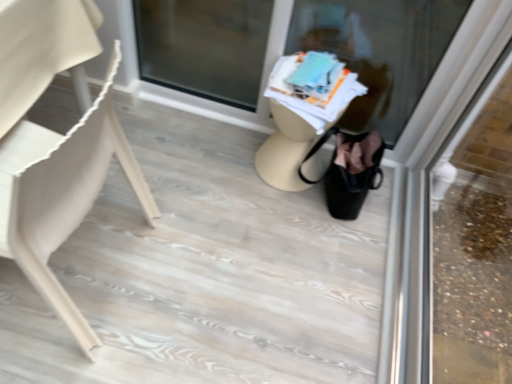
I want to click on vacant space that is in between matte beige chair at left and beige matte table at center, so tap(200, 210).